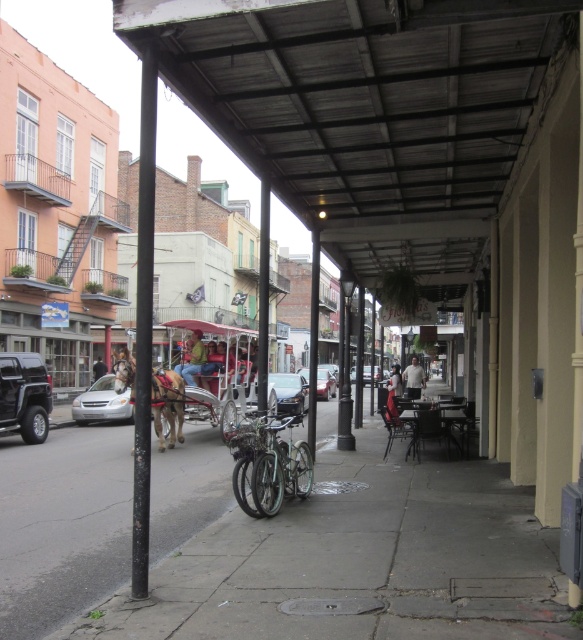
You are a delivery person trying to park your green matte bicycle at center near the black metal pole at left. Can you fit your bicycle next to the pole without touching it?

The black metal pole at left might be wider than green matte bicycle at center, so there might not be enough space to park the green matte bicycle at center next to the pole without touching it.

You are a delivery person trying to park your green matte bicycle at center near the black metal pole at left. Can you park the bicycle directly under the pole for shade?

The black metal pole at left is located above the green matte bicycle at center, so yes, you can park the bicycle directly under the pole for shade.